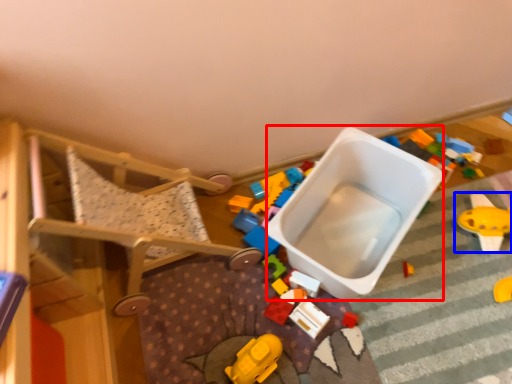
Question: Which object appears closest to the camera in this image, storage box (highlighted by a red box) or toy (highlighted by a blue box)?

Choices:
 (A) storage box
 (B) toy

Answer: (A)